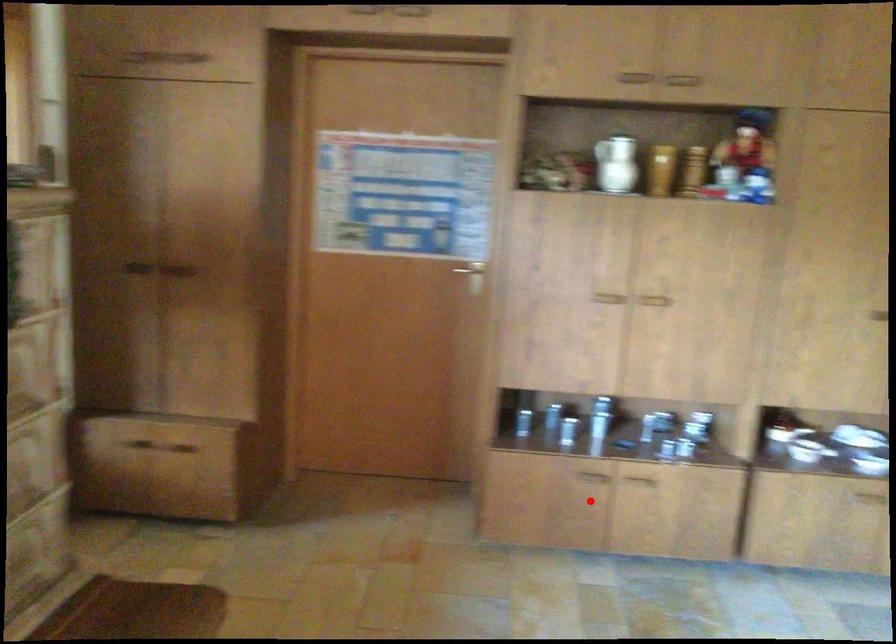
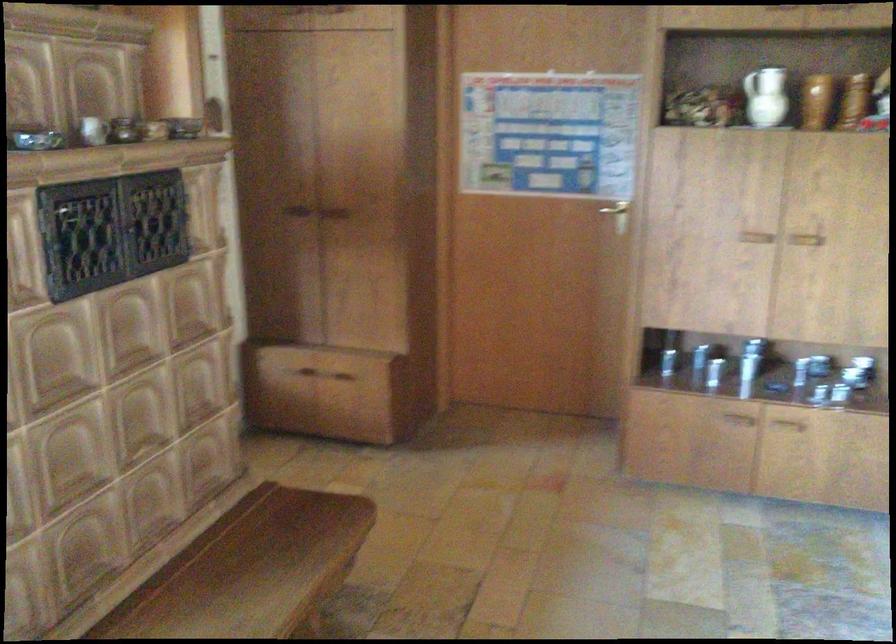
Locate, in the second image, the point that corresponds to the highlighted location in the first image.

(730, 439)